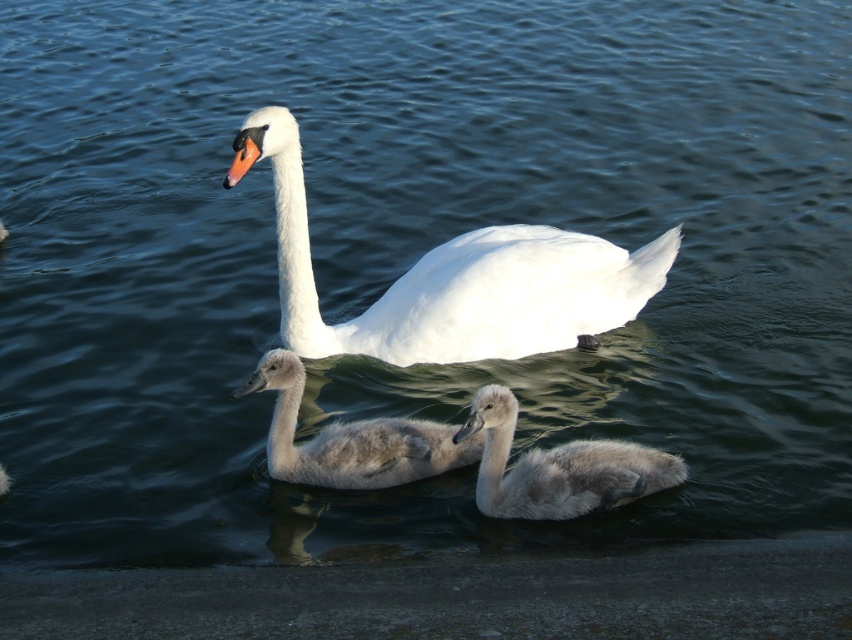
You are a wildlife photographer observing the swans. You notice two gray swans at the center of the image. Which one is closer to you, the gray fluffy swan at center or the gray downy cygnet at center?

The gray fluffy swan at center is closer to you because it is in front of the gray downy cygnet at center.

You are a wildlife photographer observing the swans. You want to capture a photo where the white glossy swan at center is the main focus. Since the gray fluffy swan at center is nearby, will you need to adjust your camera to focus on the larger swan?

The white glossy swan at center is larger in size than the gray fluffy swan at center, so you can focus on the larger swan without needing to adjust the camera since it already occupies more of the frame.